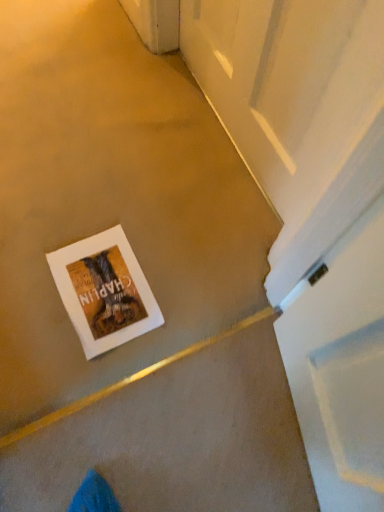
Question: In the image, is white glossy screen door at upper right on the left side or the right side of white paper postcard at center?

Choices:
 (A) right
 (B) left

Answer: (A)

Question: From their relative heights in the image, would you say white glossy screen door at upper right is taller or shorter than white paper postcard at center?

Choices:
 (A) short
 (B) tall

Answer: (B)

Question: Do you think white glossy screen door at upper right is within white paper postcard at center, or outside of it?

Choices:
 (A) inside
 (B) outside

Answer: (B)

Question: Is point (94, 266) closer or farther from the camera than point (332, 96)?

Choices:
 (A) closer
 (B) farther

Answer: (B)

Question: Is white paper postcard at center taller or shorter than white glossy screen door at upper right?

Choices:
 (A) tall
 (B) short

Answer: (B)

Question: Is white paper postcard at center bigger or smaller than white glossy screen door at upper right?

Choices:
 (A) big
 (B) small

Answer: (B)

Question: Considering the positions of white paper postcard at center and white glossy screen door at upper right in the image, is white paper postcard at center wider or thinner than white glossy screen door at upper right?

Choices:
 (A) thin
 (B) wide

Answer: (B)